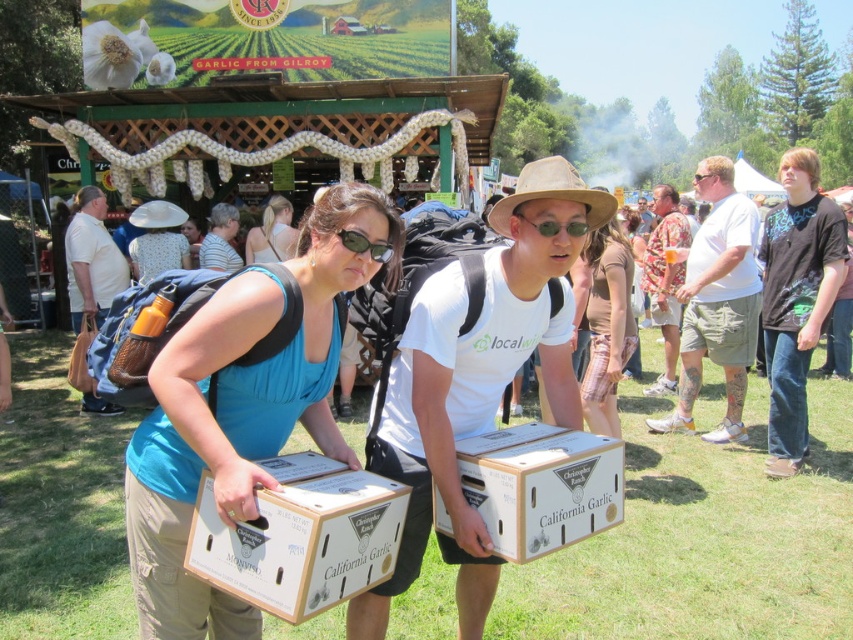
Question: Is wooden crate at center thinner than matte blue tank top at center?

Choices:
 (A) no
 (B) yes

Answer: (A)

Question: Among these objects, which one is farthest from the camera?

Choices:
 (A) blue fabric tank top at center
 (B) white cardboard box at center
 (C) wooden crate at center
 (D) matte blue tank top at center

Answer: (D)

Question: Does blue fabric tank top at center come in front of white cardboard box at center?

Choices:
 (A) yes
 (B) no

Answer: (A)

Question: Can you confirm if wooden crate at center is wider than white cardboard box at center?

Choices:
 (A) yes
 (B) no

Answer: (B)

Question: Which point is farther to the camera?

Choices:
 (A) tap(267, 221)
 (B) tap(202, 529)
 (C) tap(537, 484)

Answer: (A)

Question: Based on their relative distances, which object is nearer to the blue fabric tank top at center?

Choices:
 (A) white cardboard box at center
 (B) wooden crate at center
 (C) matte blue tank top at center

Answer: (B)